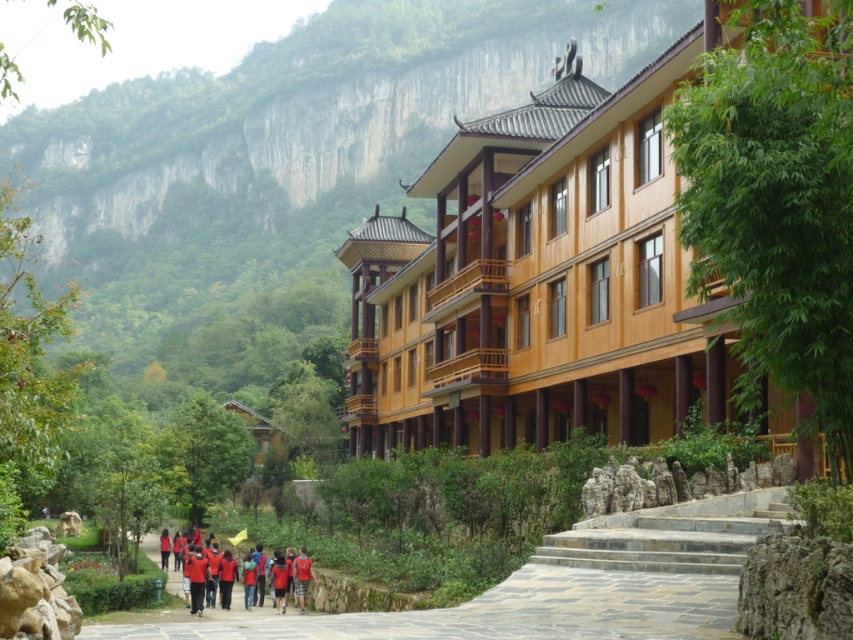
You are a visitor approaching the building and need to decide whether to walk on the smooth stone pathway at center or the red fabric group at center. Which surface is bigger and more suitable for walking?

The smooth stone pathway at center has a larger size compared to the red fabric group at center, making it more suitable for walking.

You are a visitor approaching the wooden building and notice the smooth stone pathway at center and the red fabric group at center. Which object is closer to you as you walk towards the entrance?

The smooth stone pathway at center is closer to you since it is positioned over the red fabric group at center, meaning the pathway is in front of the fabric group.